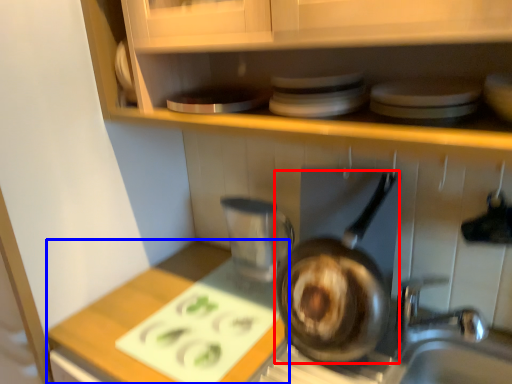
Question: Which object appears farthest to the camera in this image, frying pan (highlighted by a red box) or counter top (highlighted by a blue box)?

Choices:
 (A) frying pan
 (B) counter top

Answer: (A)